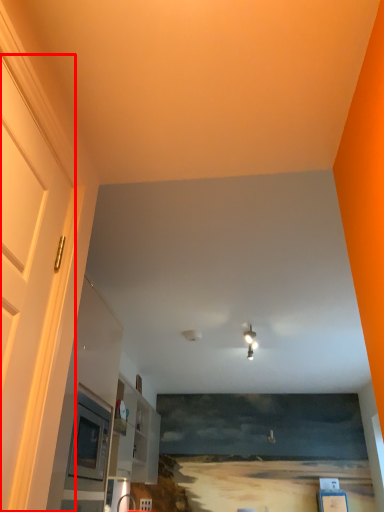
Question: From the image's perspective, what is the correct spatial positioning of door (annotated by the red box) in reference to light fixture?

Choices:
 (A) below
 (B) above

Answer: (B)